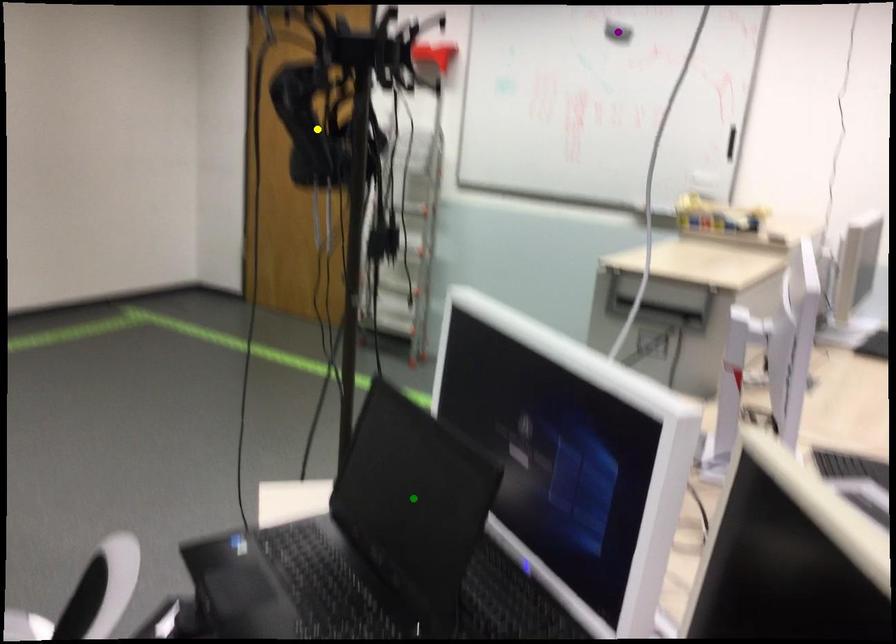
Order these from nearest to farthest:
green point | yellow point | purple point

green point
yellow point
purple point